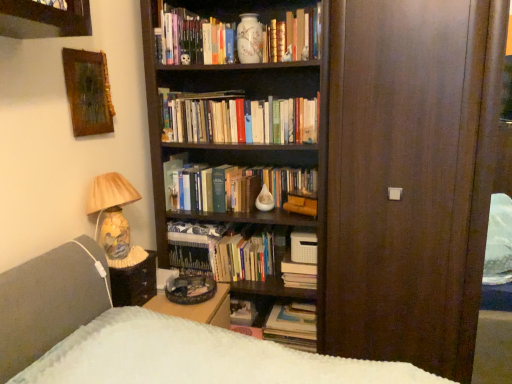
The height and width of the screenshot is (384, 512). Identify the location of empty space that is ontop of wooden side table at lower left (from a real-world perspective). (128, 258).